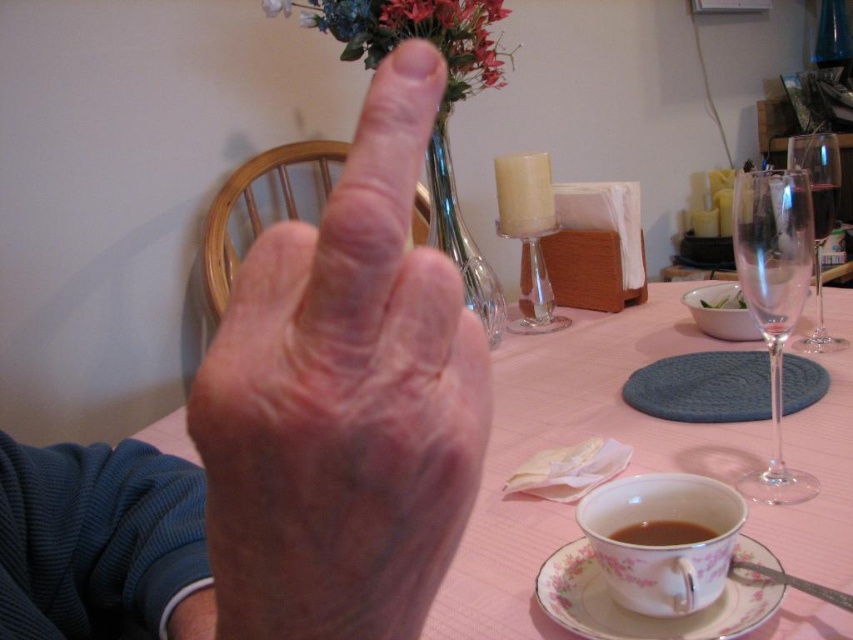
You are a bartender preparing a drink. You have to place a garnish on the brown matte cup at lower center without touching the dry skin hand at center. Is this possible given their positions?

The dry skin hand at center is in front of the brown matte cup at lower center, so you can place the garnish on the brown matte cup at lower center by moving around the hand or using a tool to reach it without touching the hand.

You are a delivery robot standing 20 inches away from the dining table. You need to deliver a small package to the exact point marked as point (776, 461) on the table. Can you reach that point without moving closer than your current distance?

The distance of point (776, 461) from viewer is 21.34 inches, so since the robot is currently 20 inches away, it needs to move 1.34 inches closer to reach the point. Therefore, the robot cannot reach the point without moving closer than its current distance of 20 inches.

You are a guest at a dinner party and see the dry skin hand at center and the brown matte cup at lower center. Which object is closer to the left side of the image?

The dry skin hand at center is to the left of the brown matte cup at lower center, so the dry skin hand at center is closer to the left side of the image.